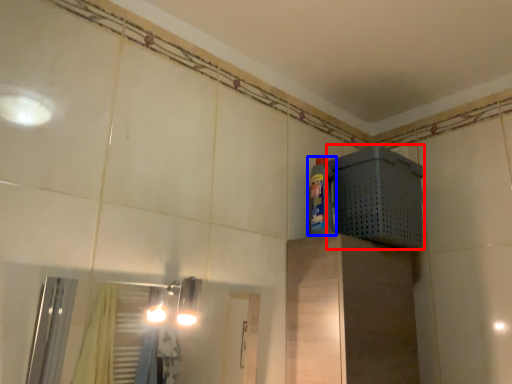
Question: Which object appears farthest to the camera in this image, appliance (highlighted by a red box) or bottle (highlighted by a blue box)?

Choices:
 (A) appliance
 (B) bottle

Answer: (B)